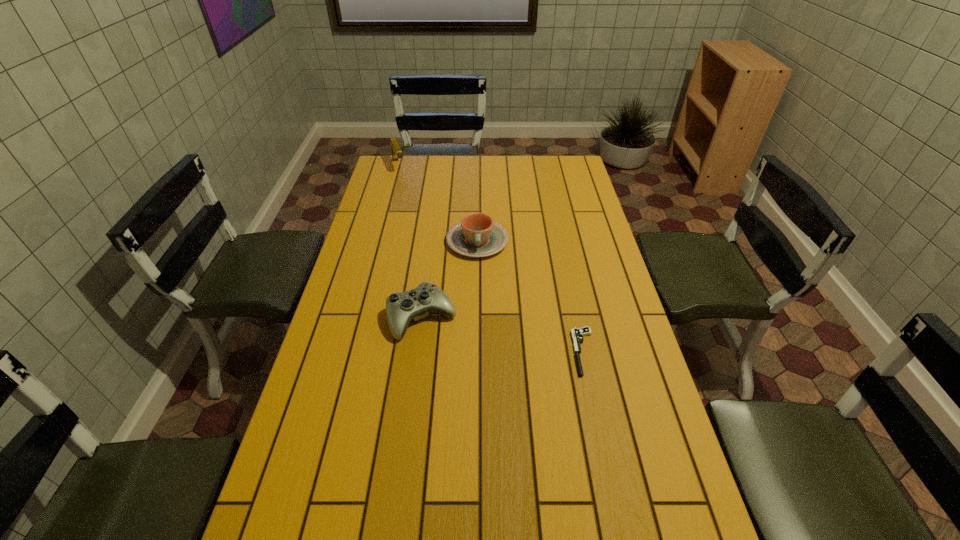
At what (x,y) coordinates should I click in order to perform the action: click on vacant space on the desktop that is between the control and the right pistol and is positioned on the handle side of the chinaware. Please return your answer as a coordinate pair (x, y). Looking at the image, I should click on (480, 330).

Where is `vacant space on the desktop that is between the control and the shortest object and is positioned at the barrel of the taller pistol`? vacant space on the desktop that is between the control and the shortest object and is positioned at the barrel of the taller pistol is located at coordinates (477, 329).